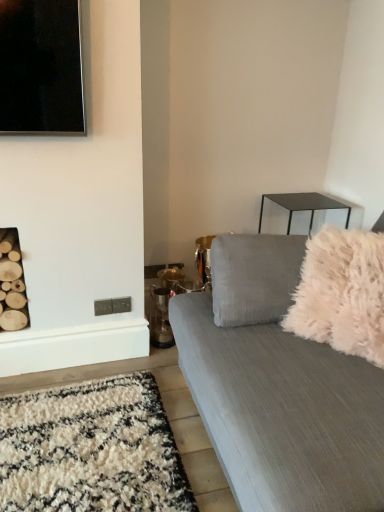
This screenshot has width=384, height=512. Find the location of `white fluffy throw pillow at right`. white fluffy throw pillow at right is located at coordinates click(x=341, y=293).

Describe the element at coordinates (341, 293) in the screenshot. I see `white fluffy throw pillow at right` at that location.

What do you see at coordinates (278, 388) in the screenshot?
I see `textured gray couch at right` at bounding box center [278, 388].

In order to face textured gray couch at right, should I rotate leftwards or rightwards?

To align with it, rotate right about 21.413°.

Find the location of a particular element. The width and height of the screenshot is (384, 512). textured gray couch at right is located at coordinates (278, 388).

The height and width of the screenshot is (512, 384). In order to click on white fluffy throw pillow at right in this screenshot , I will do `click(341, 293)`.

Which is more to the right, textured gray couch at right or white fluffy throw pillow at right?

Positioned to the right is textured gray couch at right.

Is textured gray couch at right in front of or behind white fluffy throw pillow at right in the image?

Clearly, textured gray couch at right is in front of white fluffy throw pillow at right.

Which is more distant, [252,483] or [311,294]?

The point [311,294] is behind.

From the image's perspective, does textured gray couch at right appear lower than white fluffy throw pillow at right?

Yes.

From a real-world perspective, is textured gray couch at right positioned above or below white fluffy throw pillow at right?

In terms of real-world spatial position, textured gray couch at right is below white fluffy throw pillow at right.

Which of these two, textured gray couch at right or white fluffy throw pillow at right, is thinner?

white fluffy throw pillow at right is thinner.

From their relative heights in the image, would you say textured gray couch at right is taller or shorter than white fluffy throw pillow at right?

Clearly, textured gray couch at right is taller compared to white fluffy throw pillow at right.

Is textured gray couch at right bigger or smaller than white fluffy throw pillow at right?

Considering their sizes, textured gray couch at right takes up more space than white fluffy throw pillow at right.

Is textured gray couch at right situated inside white fluffy throw pillow at right or outside?

textured gray couch at right lies outside white fluffy throw pillow at right.

Is textured gray couch at right beside white fluffy throw pillow at right?

textured gray couch at right and white fluffy throw pillow at right are clearly separated.

Is textured gray couch at right oriented away from white fluffy throw pillow at right?

Yes, textured gray couch at right's orientation is away from white fluffy throw pillow at right.

This screenshot has width=384, height=512. I want to click on studio couch below the white fluffy throw pillow at right (from a real-world perspective), so click(278, 388).

From the picture: Can you confirm if white fluffy throw pillow at right is positioned to the right of textured gray couch at right?

Incorrect, white fluffy throw pillow at right is not on the right side of textured gray couch at right.

Is white fluffy throw pillow at right closer to the viewer compared to textured gray couch at right?

No, the depth of white fluffy throw pillow at right is greater than that of textured gray couch at right.

Considering the positions of points (355, 257) and (250, 487), is point (355, 257) farther from camera compared to point (250, 487)?

Yes, it is behind point (250, 487).

From the image's perspective, would you say white fluffy throw pillow at right is positioned over textured gray couch at right?

Yes, from the image's perspective, white fluffy throw pillow at right is over textured gray couch at right.

From a real-world perspective, who is located higher, white fluffy throw pillow at right or textured gray couch at right?

In real-world perspective, white fluffy throw pillow at right is above.

Which object is thinner, white fluffy throw pillow at right or textured gray couch at right?

white fluffy throw pillow at right.

Between white fluffy throw pillow at right and textured gray couch at right, which one has less height?

white fluffy throw pillow at right.

Between white fluffy throw pillow at right and textured gray couch at right, which one has larger size?

Bigger between the two is textured gray couch at right.

Is white fluffy throw pillow at right not within textured gray couch at right?

No, most part of white fluffy throw pillow at right lies within textured gray couch at right.

Is white fluffy throw pillow at right with textured gray couch at right?

No, white fluffy throw pillow at right is not with textured gray couch at right.

Is white fluffy throw pillow at right oriented towards textured gray couch at right?

Yes.

How different are the orientations of white fluffy throw pillow at right and textured gray couch at right in degrees?

The facing directions of white fluffy throw pillow at right and textured gray couch at right are 39.7 degrees apart.

You are a GUI agent. You are given a task and a screenshot of the screen. Output one action in this format:
    pyautogui.click(x=<x>, y=<y>)
    Task: Click on the throw pillow that is above the textured gray couch at right (from a real-world perspective)
    Image resolution: width=384 pixels, height=512 pixels.
    Given the screenshot: What is the action you would take?
    pyautogui.click(x=341, y=293)

At what (x,y) coordinates should I click in order to perform the action: click on studio couch located on the right of white fluffy throw pillow at right. Please return your answer as a coordinate pair (x, y). Image resolution: width=384 pixels, height=512 pixels. Looking at the image, I should click on (278, 388).

Identify the location of throw pillow above the textured gray couch at right (from a real-world perspective). The height and width of the screenshot is (512, 384). (341, 293).